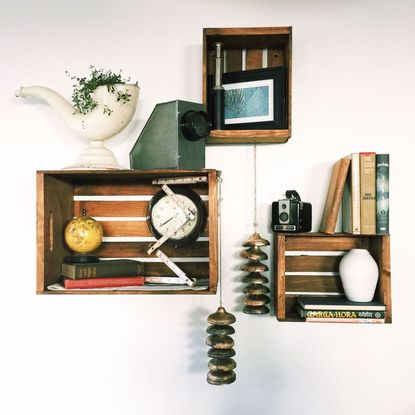
Image resolution: width=415 pixels, height=415 pixels. Identify the location of book. pos(364,201).